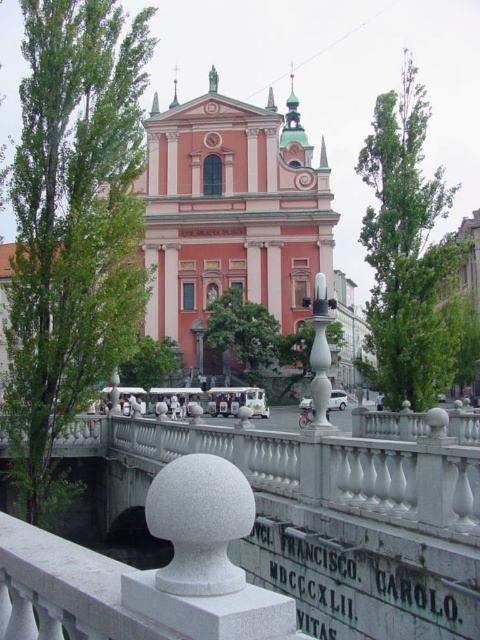
You are a photographer planning to capture both the metallic silver car at center and the white glossy car at center in a single frame. Given their sizes, which car would appear closer to the camera in the final photo?

The metallic silver car at center is smaller than the white glossy car at center, so the white glossy car at center would appear closer to the camera in the final photo since larger objects in a photo typically indicate closer proximity.

You are a delivery driver needing to unload packages between the two cars. The loading area requires a minimum of 10 meters to maneuver safely. Can you safely maneuver between the metallic silver car at center and the white glossy car at center?

The distance between the metallic silver car at center and the white glossy car at center is 9.90 meters, which is slightly less than the required 10 meters. Therefore, it is not safe to maneuver between them.

You are standing in front of the historic church and want to take a photo of the two points marked in the scene. Which point, point [252,392] or point [344,406], appears closer to you in the image?

Point [252,392] appears closer to you because it is closer to the camera than point [344,406].